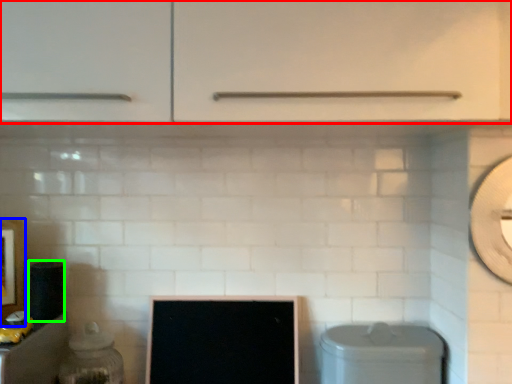
Question: Which object is the farthest from cabinetry (highlighted by a red box)? Choose among these: picture frame (highlighted by a blue box) or appliance (highlighted by a green box).

Choices:
 (A) picture frame
 (B) appliance

Answer: (A)